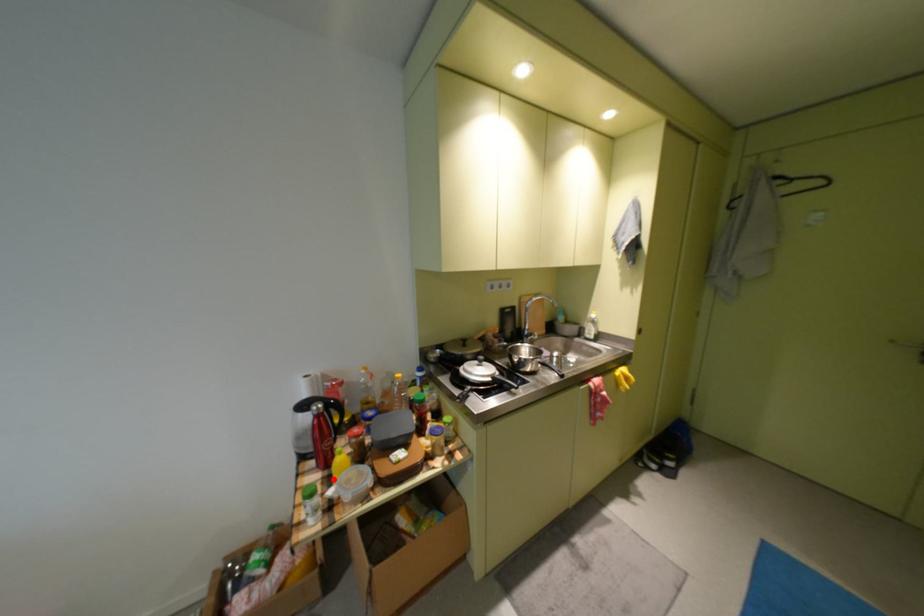
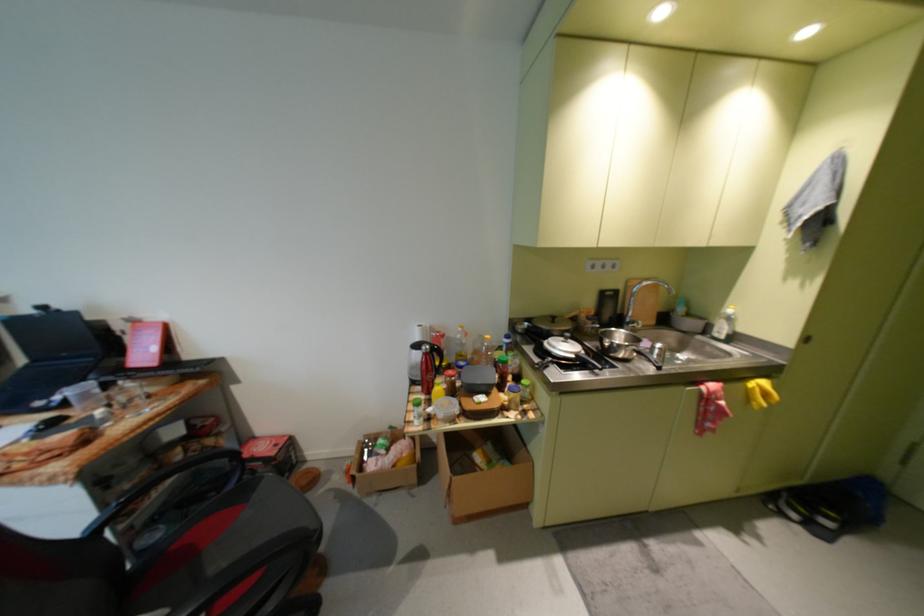
Where in the second image is the point corresponding to the highlighted location from the first image?

(435, 400)